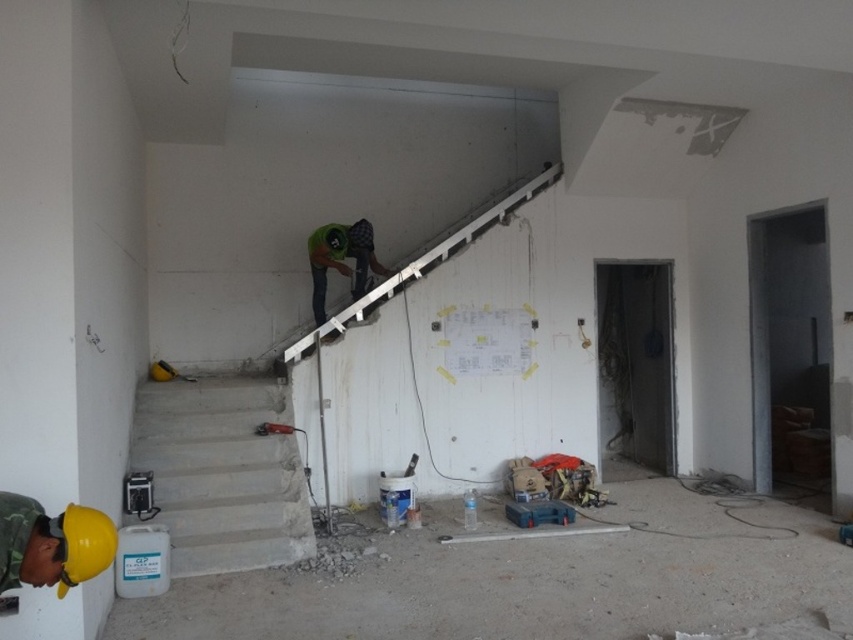
Can you confirm if yellow hard hat at lower left is smaller than green fabric construction worker at center?

Yes.

Can you confirm if yellow hard hat at lower left is positioned above green fabric construction worker at center?

Actually, yellow hard hat at lower left is below green fabric construction worker at center.

Locate an element on the screen. The width and height of the screenshot is (853, 640). yellow hard hat at lower left is located at coordinates (51, 544).

Who is higher up, concrete stairs at lower left or yellow hard hat at lower left?

yellow hard hat at lower left is higher up.

Who is positioned more to the left, concrete stairs at lower left or yellow hard hat at lower left?

concrete stairs at lower left

Where is `concrete stairs at lower left`? concrete stairs at lower left is located at coordinates (222, 474).

Can you confirm if concrete stairs at lower left is taller than green fabric construction worker at center?

Incorrect, concrete stairs at lower left's height is not larger of green fabric construction worker at center's.

Who is more distant from viewer, (252, 538) or (357, 230)?

The point (357, 230) is more distant.

Does point (164, 509) lie behind point (355, 248)?

No, (164, 509) is in front of (355, 248).

Where is `concrete stairs at lower left`? The width and height of the screenshot is (853, 640). concrete stairs at lower left is located at coordinates (222, 474).